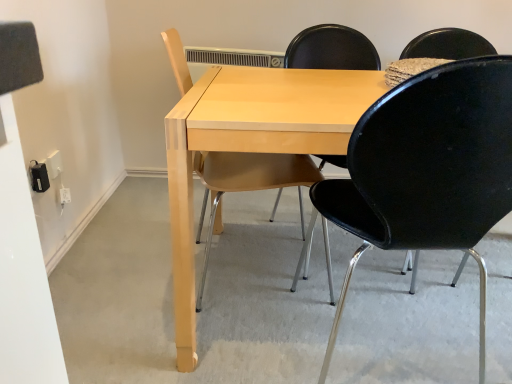
Find the location of `free spot below light wood table at center (from a real-world perspective)`. free spot below light wood table at center (from a real-world perspective) is located at coordinates (373, 286).